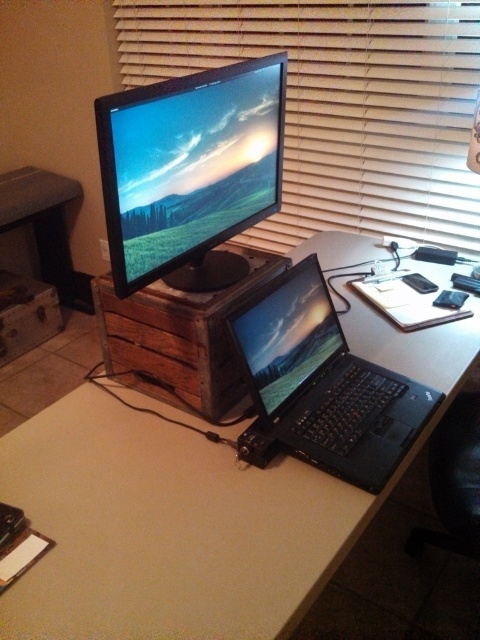
Who is taller, black matte laptop at center or glossy plastic laptop at center?

black matte laptop at center is taller.

Who is higher up, black matte laptop at center or glossy plastic laptop at center?

Positioned higher is glossy plastic laptop at center.

Where is `black matte laptop at center`? black matte laptop at center is located at coordinates (321, 385).

In the scene shown: Is wooden crate at center bigger than glossy plastic laptop at center?

Correct, wooden crate at center is larger in size than glossy plastic laptop at center.

Is wooden crate at center smaller than glossy plastic laptop at center?

Incorrect, wooden crate at center is not smaller in size than glossy plastic laptop at center.

I want to click on wooden crate at center, so click(x=192, y=509).

Between wooden crate at center and wooden blind at upper center, which one is positioned lower?

wooden crate at center is lower down.

Is point (156, 442) positioned behind point (262, 1)?

No, (156, 442) is closer to viewer.

The image size is (480, 640). Find the location of `wooden crate at center`. wooden crate at center is located at coordinates (192, 509).